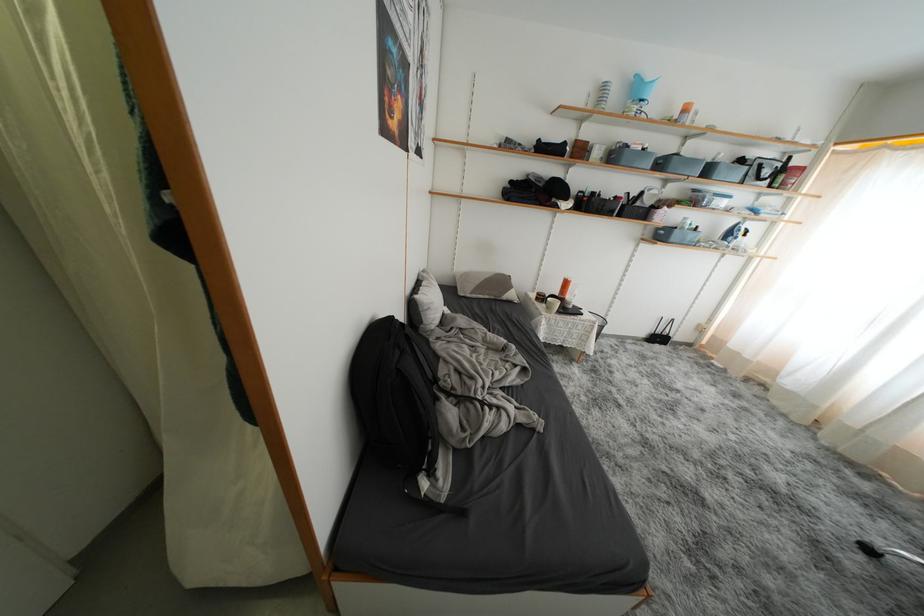
Where would you squeez the spray bottle trigger? Please return your answer as a coordinate pair (x, y).

(566, 288)